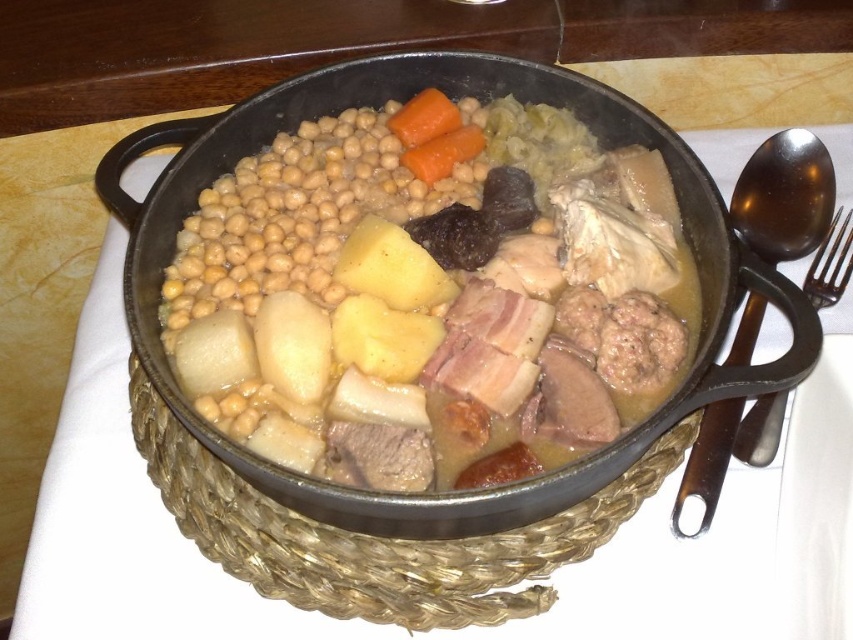
Question: Which point appears farthest from the camera in this image?

Choices:
 (A) click(x=747, y=339)
 (B) click(x=833, y=285)

Answer: (B)

Question: Which object is farther from the camera taking this photo?

Choices:
 (A) golden brown stew at center
 (B) shiny metal spoon at right
 (C) black metal fork at right

Answer: (C)

Question: Which of the following is the farthest from the observer?

Choices:
 (A) black metal fork at right
 (B) shiny metal spoon at right
 (C) golden brown stew at center

Answer: (A)

Question: Can you confirm if golden brown stew at center is positioned to the right of black metal fork at right?

Choices:
 (A) yes
 (B) no

Answer: (B)

Question: Does golden brown stew at center have a smaller size compared to shiny metal spoon at right?

Choices:
 (A) no
 (B) yes

Answer: (A)

Question: Does shiny metal spoon at right appear over black metal fork at right?

Choices:
 (A) no
 (B) yes

Answer: (A)